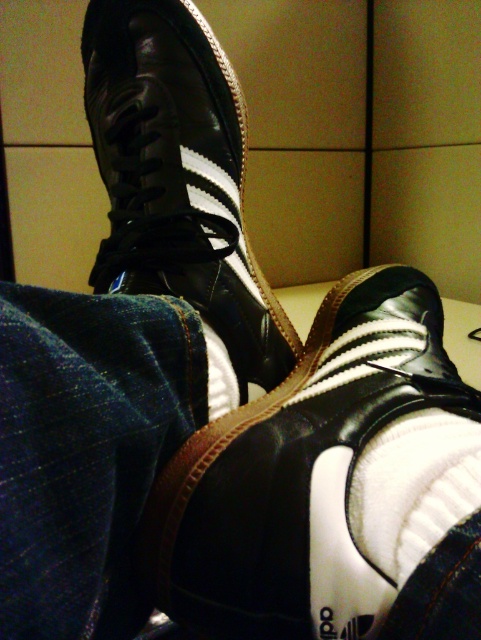
Can you confirm if black leather shoe at center is positioned above white fluffy sock at center?

Yes.

Who is positioned more to the left, black leather shoe at center or white fluffy sock at center?

black leather shoe at center

Who is more distant from viewer, (248, 464) or (423, 417)?

Positioned behind is point (423, 417).

Identify the location of black leather shoe at center. The height and width of the screenshot is (640, 481). (300, 476).

Who is higher up, black leather shoe at center or black leather shoe at upper center?

Positioned higher is black leather shoe at upper center.

Is black leather shoe at center thinner than black leather shoe at upper center?

No, black leather shoe at center is not thinner than black leather shoe at upper center.

The width and height of the screenshot is (481, 640). What do you see at coordinates (300, 476) in the screenshot?
I see `black leather shoe at center` at bounding box center [300, 476].

At what (x,y) coordinates should I click in order to perform the action: click on black leather shoe at center. Please return your answer as a coordinate pair (x, y). This screenshot has height=640, width=481. Looking at the image, I should click on (300, 476).

Does black leather shoe at upper center have a greater height compared to white fluffy sock at center?

Correct, black leather shoe at upper center is much taller as white fluffy sock at center.

Is black leather shoe at upper center smaller than white fluffy sock at center?

No, black leather shoe at upper center is not smaller than white fluffy sock at center.

This screenshot has width=481, height=640. Identify the location of black leather shoe at upper center. (177, 177).